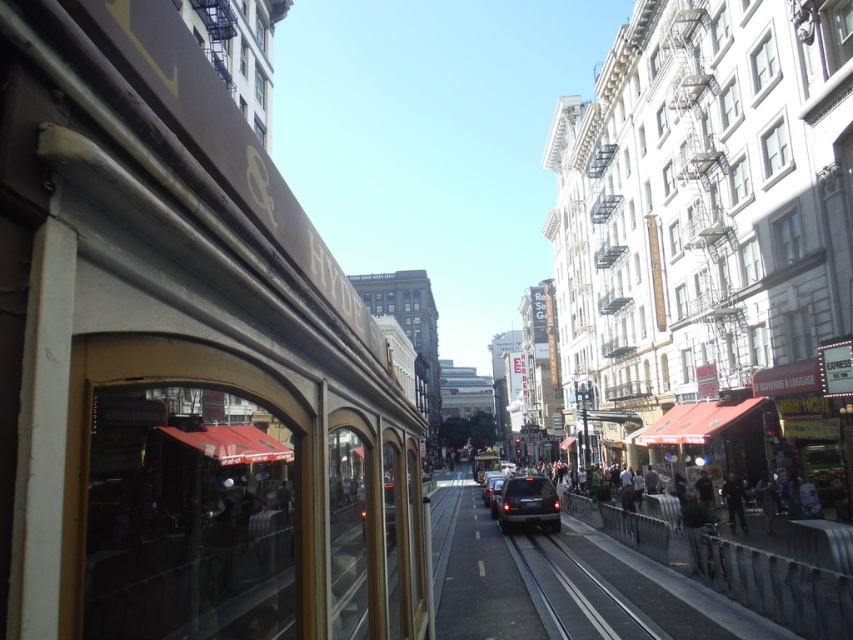
Who is lower down, shiny black suv at center or shiny black car at center?

shiny black car at center is lower down.

Does shiny black suv at center come behind shiny black car at center?

No.

Who is more distant from viewer, [511,515] or [485,497]?

The point [485,497] is behind.

This screenshot has height=640, width=853. I want to click on shiny black suv at center, so click(x=527, y=502).

Is dark gray jacket at lower right thinner than dark blue jeans at lower right?

No.

Can you confirm if dark gray jacket at lower right is positioned to the right of dark blue jeans at lower right?

In fact, dark gray jacket at lower right is to the left of dark blue jeans at lower right.

The image size is (853, 640). Find the location of `dark gray jacket at lower right`. dark gray jacket at lower right is located at coordinates (733, 500).

Find the location of a particular element. dark gray jacket at lower right is located at coordinates (733, 500).

Can you confirm if metallic gray train track at center is positioned to the left of shiny black suv at center?

Indeed, metallic gray train track at center is positioned on the left side of shiny black suv at center.

Is point (589, 620) behind point (546, 513)?

No.

Where is `metallic gray train track at center`? metallic gray train track at center is located at coordinates (575, 593).